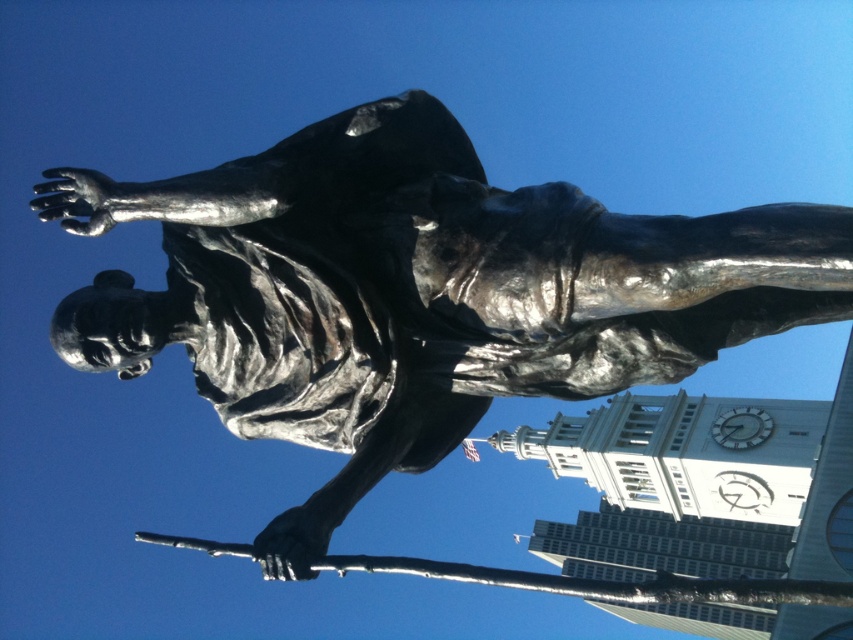
Question: Can you confirm if white stone clock tower at center is positioned to the left of white glossy clock at upper right?

Choices:
 (A) no
 (B) yes

Answer: (B)

Question: Which of the following is the farthest from the observer?

Choices:
 (A) white stone clock tower at center
 (B) white glossy clock at upper right

Answer: (B)

Question: Can you confirm if white stone clock tower at center is wider than white glossy clock at upper right?

Choices:
 (A) yes
 (B) no

Answer: (A)

Question: Which object is closer to the camera taking this photo?

Choices:
 (A) white stone clock tower at center
 (B) white glossy clock at upper right

Answer: (A)

Question: Can you confirm if white stone clock tower at center is positioned to the left of white glossy clock at upper right?

Choices:
 (A) no
 (B) yes

Answer: (B)